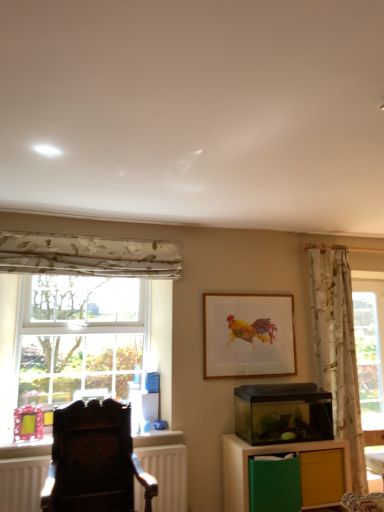
Question: Can you confirm if transparent glass aquarium at center-right is thinner than matte yellow drawer at lower right?

Choices:
 (A) no
 (B) yes

Answer: (A)

Question: Is transparent glass aquarium at center-right to the right of matte yellow drawer at lower right from the viewer's perspective?

Choices:
 (A) no
 (B) yes

Answer: (A)

Question: Could matte yellow drawer at lower right be considered to be inside transparent glass aquarium at center-right?

Choices:
 (A) no
 (B) yes

Answer: (A)

Question: Is transparent glass aquarium at center-right completely or partially outside of matte yellow drawer at lower right?

Choices:
 (A) yes
 (B) no

Answer: (A)

Question: From a real-world perspective, does transparent glass aquarium at center-right sit lower than matte yellow drawer at lower right?

Choices:
 (A) no
 (B) yes

Answer: (A)

Question: Does transparent glass aquarium at center-right have a greater height compared to matte yellow drawer at lower right?

Choices:
 (A) no
 (B) yes

Answer: (B)

Question: Is floral fabric curtain at right, arranged as the 1th curtain when viewed from the right, shorter than wooden frame at center?

Choices:
 (A) no
 (B) yes

Answer: (A)

Question: Considering the relative sizes of floral fabric curtain at right, the 1th curtain positioned from the bottom, and wooden frame at center in the image provided, is floral fabric curtain at right, the 1th curtain positioned from the bottom, bigger than wooden frame at center?

Choices:
 (A) no
 (B) yes

Answer: (B)

Question: Is floral fabric curtain at right, the 1th curtain positioned from the bottom, closer to camera compared to wooden frame at center?

Choices:
 (A) yes
 (B) no

Answer: (A)

Question: Does floral fabric curtain at right, which appears as the second curtain when viewed from the left, have a greater width compared to wooden frame at center?

Choices:
 (A) no
 (B) yes

Answer: (B)

Question: From a real-world perspective, is floral fabric curtain at right, positioned as the second curtain in top-to-bottom order, positioned under wooden frame at center based on gravity?

Choices:
 (A) no
 (B) yes

Answer: (B)

Question: Could wooden frame at center be considered to be inside floral fabric curtain at right, positioned as the second curtain in top-to-bottom order?

Choices:
 (A) yes
 (B) no

Answer: (B)

Question: From the image's perspective, would you say wooden frame at center is shown under floral fabric curtain at left, which appears as the 2th curtain when viewed from the right?

Choices:
 (A) no
 (B) yes

Answer: (B)